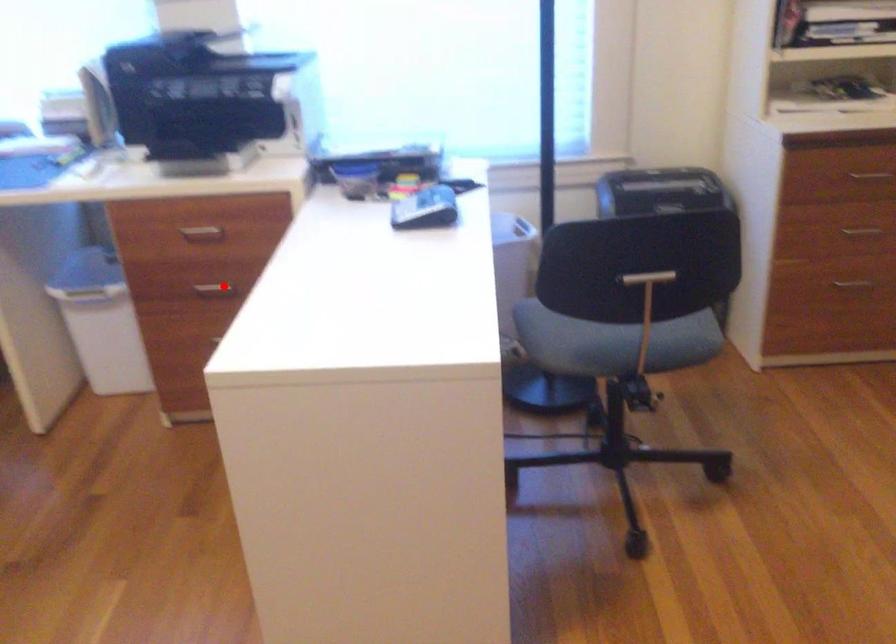
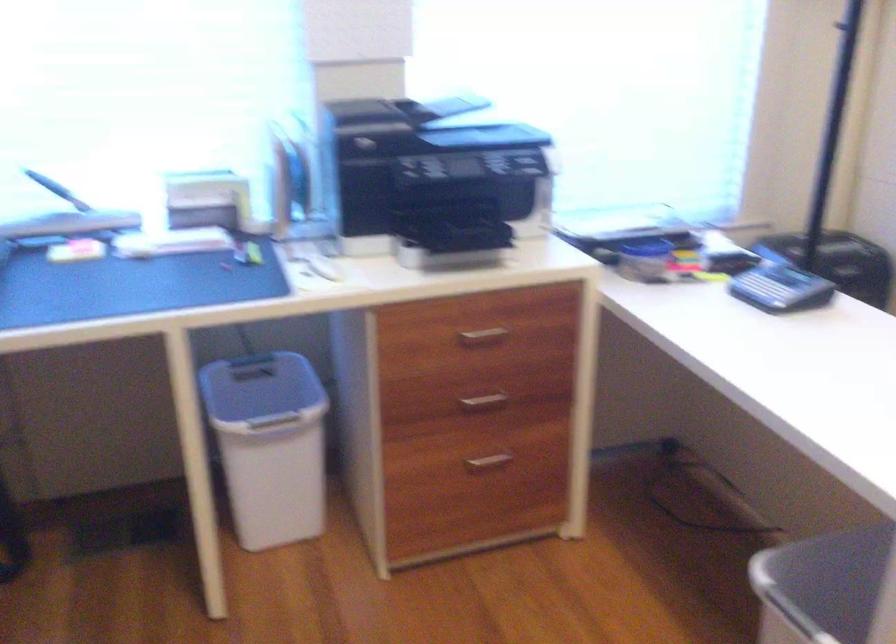
Find the pixel in the second image that matches the highlighted location in the first image.

(484, 401)